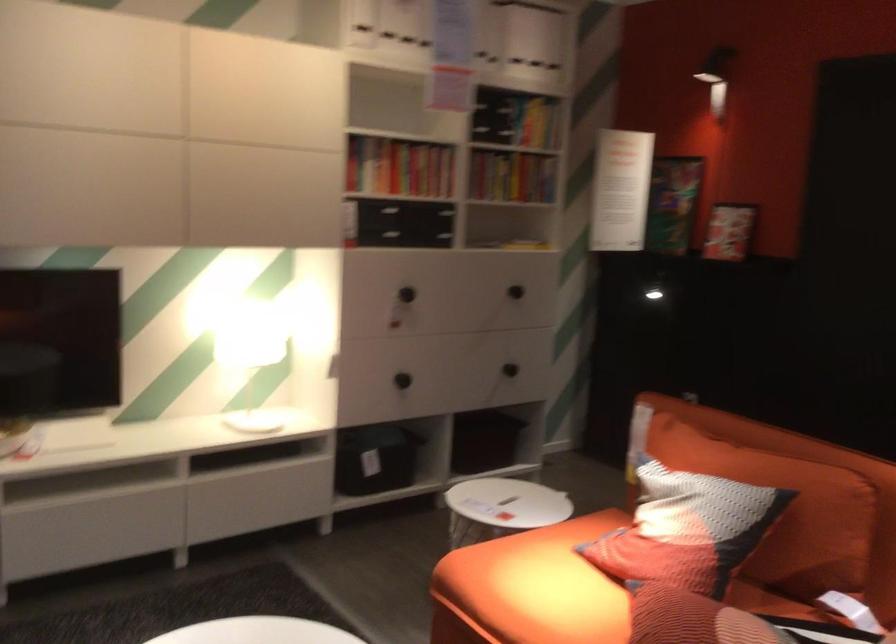
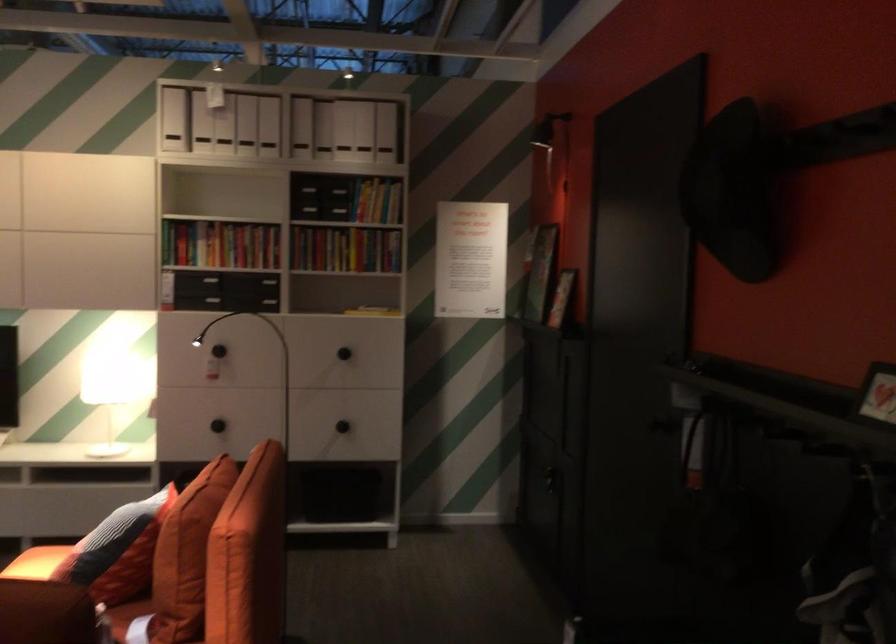
Question: I am providing you with two images of the same scene from different viewpoints. Please identify which objects are invisible in image2.

Choices:
 (A) white magazine file
 (B) light wood chair seat
 (C) colorful book
 (D) black storage bin

Answer: (D)